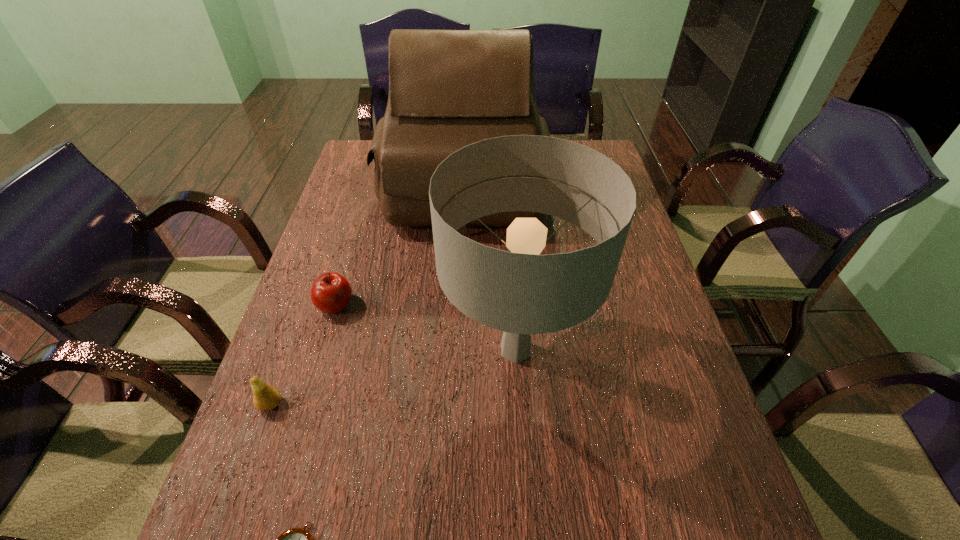
I want to click on apple present at the left edge, so click(x=331, y=292).

The height and width of the screenshot is (540, 960). In order to click on pear that is at the left edge in this screenshot , I will do `click(266, 397)`.

The image size is (960, 540). In order to click on object at the far left corner in this screenshot , I will do `click(448, 89)`.

This screenshot has height=540, width=960. I want to click on vacant space at the left edge, so click(333, 380).

Find the location of a particular element. vacant space at the right edge of the desktop is located at coordinates (680, 509).

At what (x,y) coordinates should I click in order to perform the action: click on unoccupied area between the lampshade and the apple. Please return your answer as a coordinate pair (x, y). The width and height of the screenshot is (960, 540). Looking at the image, I should click on (425, 327).

Find the location of a particular element. vacant space that's between the apple and the pear is located at coordinates (303, 354).

You are a GUI agent. You are given a task and a screenshot of the screen. Output one action in this format:
    pyautogui.click(x=<x>, y=<y>)
    Task: Click on the empty space between the apple and the lampshade
    
    Given the screenshot: What is the action you would take?
    pyautogui.click(x=425, y=327)

In order to click on vacant area that lies between the apple and the pear in this screenshot , I will do `click(303, 354)`.

Image resolution: width=960 pixels, height=540 pixels. Find the location of `vacant point located between the pear and the apple`. vacant point located between the pear and the apple is located at coordinates (303, 354).